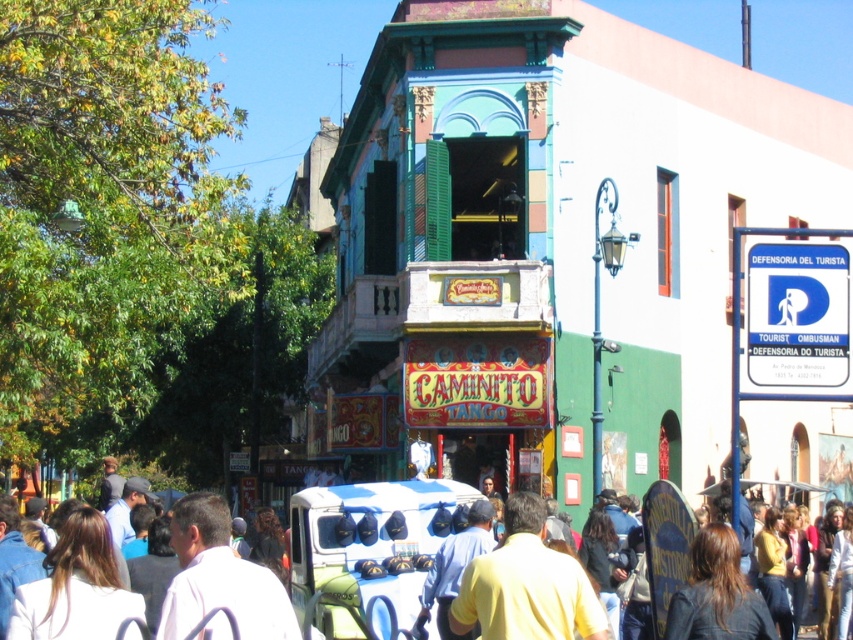
Locate an element on the screen. The image size is (853, 640). yellow matte shirt at center is located at coordinates (526, 586).

Does yellow matte shirt at center appear on the right side of yellow cotton shirt at center?

Incorrect, yellow matte shirt at center is not on the right side of yellow cotton shirt at center.

Between point (553, 580) and point (672, 536), which one is positioned behind?

The point (672, 536) is behind.

The height and width of the screenshot is (640, 853). Find the location of `yellow matte shirt at center`. yellow matte shirt at center is located at coordinates (526, 586).

Measure the distance between white matte shirt at center and yellow cotton shirt at center.

A distance of 8.68 meters exists between white matte shirt at center and yellow cotton shirt at center.

Is white matte shirt at center taller than yellow cotton shirt at center?

No, white matte shirt at center is not taller than yellow cotton shirt at center.

Is point (231, 554) less distant than point (659, 513)?

Yes, point (231, 554) is closer to viewer.

Locate an element on the screen. The height and width of the screenshot is (640, 853). white matte shirt at center is located at coordinates (219, 577).

Can you confirm if yellow matte shirt at center is bigger than white matte shirt at center?

Actually, yellow matte shirt at center might be smaller than white matte shirt at center.

Between yellow matte shirt at center and white matte shirt at center, which one appears on the right side from the viewer's perspective?

yellow matte shirt at center

Is point (502, 604) closer to viewer compared to point (223, 560)?

No, it is not.

Locate an element on the screen. This screenshot has height=640, width=853. yellow matte shirt at center is located at coordinates (526, 586).